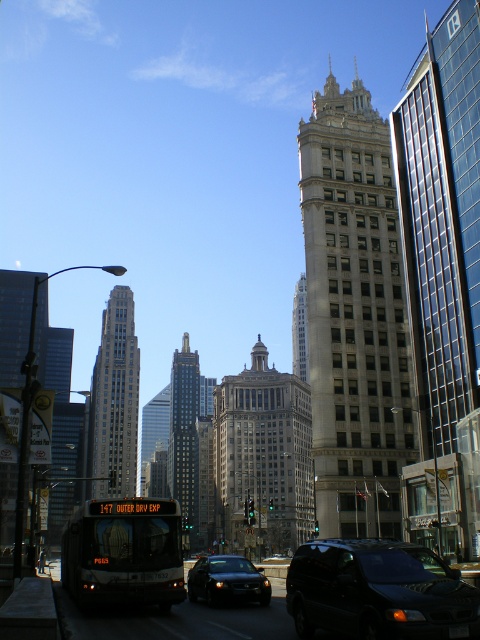
Based on the photo, which is more to the right, matte black bus at lower center or dark gray glass skyscraper at center?

matte black bus at lower center

Does point (171, 513) lie in front of point (176, 438)?

That is True.

Where is `matte black bus at lower center`? The width and height of the screenshot is (480, 640). matte black bus at lower center is located at coordinates (123, 552).

Which of these two, shiny black van at lower right or matte glass skyscraper at left, stands taller?

matte glass skyscraper at left

Which is behind, point (453, 602) or point (64, 412)?

The point (64, 412) is more distant.

The height and width of the screenshot is (640, 480). Describe the element at coordinates (377, 592) in the screenshot. I see `shiny black van at lower right` at that location.

At what (x,y) coordinates should I click in order to perform the action: click on shiny black van at lower right. Please return your answer as a coordinate pair (x, y). Looking at the image, I should click on (377, 592).

Between point (300, 145) and point (291, 336), which one is positioned behind?

The point (291, 336) is more distant.

Does light beige stone tower at center come in front of beige stone tower at center?

Yes, it is in front of beige stone tower at center.

Identify the location of light beige stone tower at center. This screenshot has height=640, width=480. (354, 314).

I want to click on light beige stone tower at center, so click(x=354, y=314).